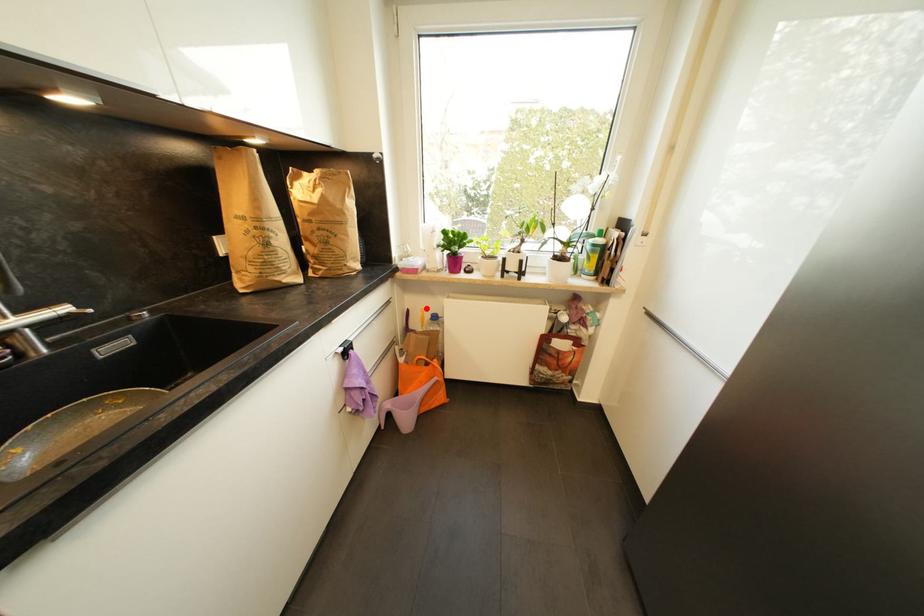
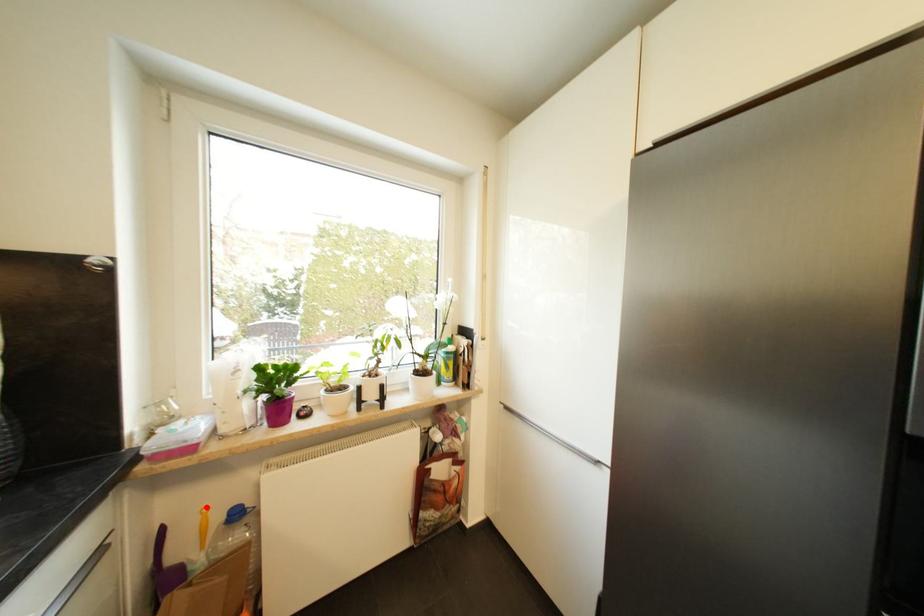
I am providing you with two images of the same scene from different viewpoints. A red point is marked on the first image and another point is marked on the second image. Is the marked point in image1 the same physical position as the marked point in image2?

Yes